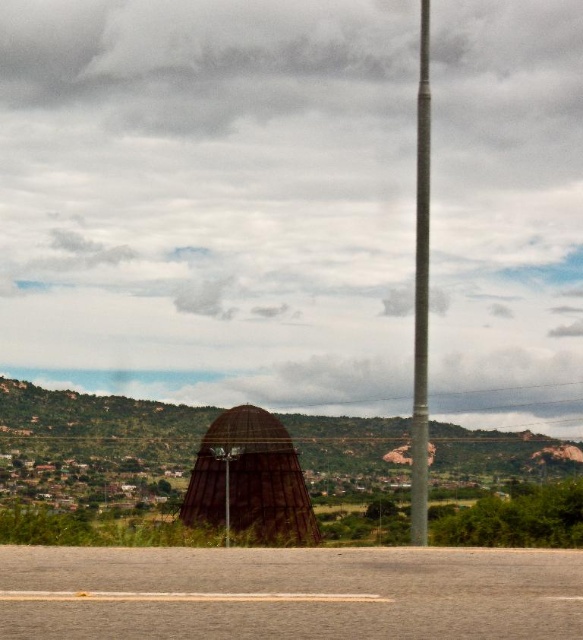
You are a surveyor assessing the landscape. You need to determine which object is taller between the brown textured dome at center and the metallic pole at right. Based on the scene, can you identify the taller object?

The metallic pole at right is taller than the brown textured dome at center.

You are a photographer planning to capture the brown textured dome at center and the metallic pole at center in the same frame. Based on their positions, which object will appear closer to the bottom of the photo?

The brown textured dome at center is located below the metallic pole at center, so it will appear closer to the bottom of the photo.

You are a photographer planning to take a wide shot of the landscape. You want to ensure both the brown textured dome at center and the metallic pole at right are fully visible in the frame. Based on their positions, which object might partially obscure the other?

The metallic pole at right is behind the brown textured dome at center, so the brown textured dome at center might partially obscure the metallic pole at right.